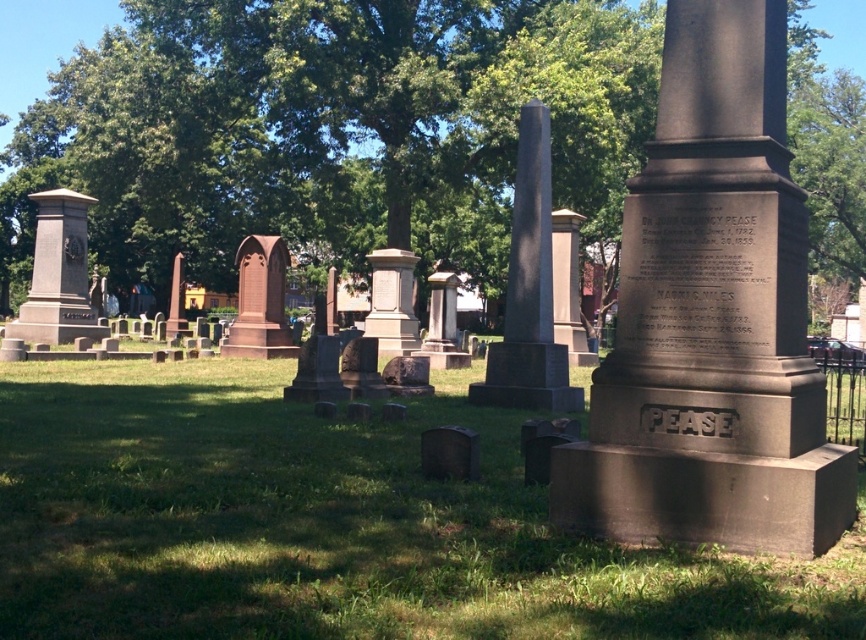
You are a visitor at the cemetery and want to take a photo of the green leafy tree at upper center and the brown stone monument at center. Which object will appear bigger in your photo?

The green leafy tree at upper center will appear bigger in the photo because it is larger in size than the brown stone monument at center.

You are standing at the entrance of the cemetery and want to locate the brown stone monument at center. Which direction should you look relative to the green leafy tree at upper center?

The green leafy tree at upper center is to the left of the brown stone monument at center, so you should look to the right of the green leafy tree at upper center to find the brown stone monument at center.